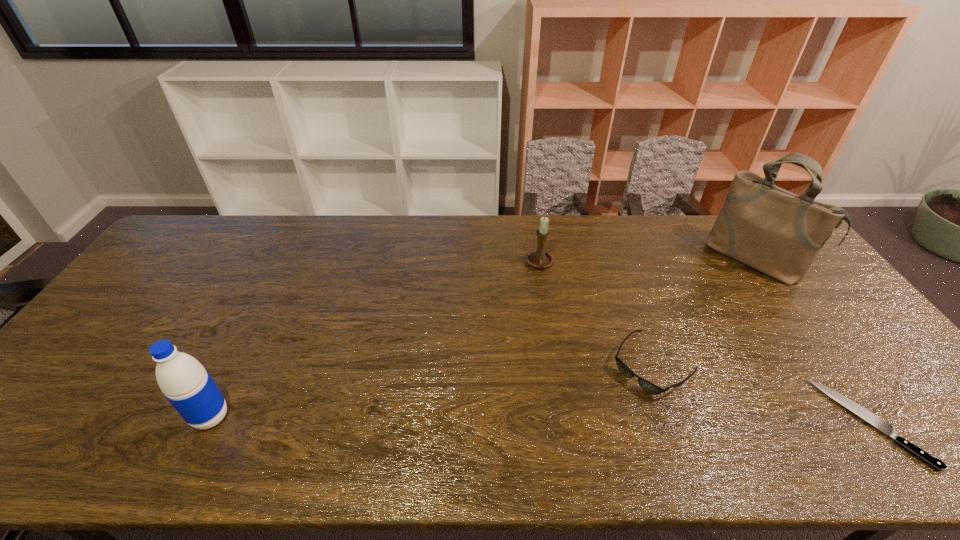
Identify the location of free space at the right edge. Image resolution: width=960 pixels, height=540 pixels. (843, 334).

I want to click on free region at the far left corner, so click(219, 218).

Identify the location of vacant area that lies between the second shortest object and the shortest object. This screenshot has width=960, height=540. (761, 394).

The height and width of the screenshot is (540, 960). What are the coordinates of `free space that is in between the shortest object and the tallest object` in the screenshot? It's located at (812, 341).

Find the location of a particular element. Image resolution: width=960 pixels, height=540 pixels. free spot between the leftmost object and the fourth object from right to left is located at coordinates (375, 341).

Locate an element on the screen. Image resolution: width=960 pixels, height=540 pixels. free space between the steak knife and the fourth object from right to left is located at coordinates (705, 343).

Image resolution: width=960 pixels, height=540 pixels. In order to click on vacant area that lies between the steak knife and the third tallest object in this screenshot , I will do `click(705, 343)`.

Identify the location of free space that is in between the fourth object from right to left and the steak knife. Image resolution: width=960 pixels, height=540 pixels. (705, 343).

The height and width of the screenshot is (540, 960). In order to click on free space between the fourth shortest object and the shortest object in this screenshot , I will do `click(540, 420)`.

The width and height of the screenshot is (960, 540). Find the location of `free spot between the shortest object and the third object from right to left`. free spot between the shortest object and the third object from right to left is located at coordinates (761, 394).